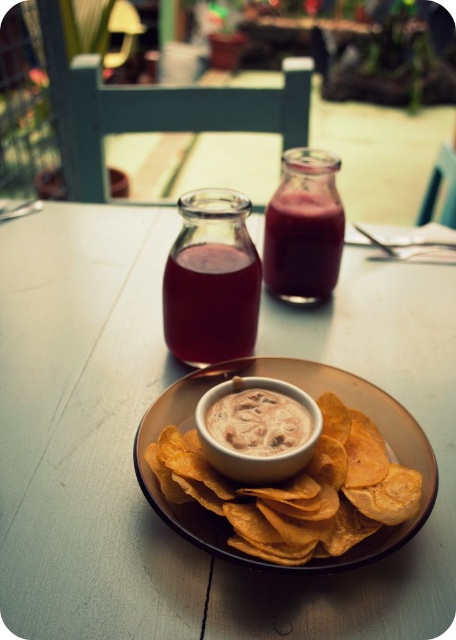
Is golden crispy chips at center wider than translucent glass bottle at center?

Yes, golden crispy chips at center is wider than translucent glass bottle at center.

Looking at this image, is golden crispy chips at center bigger than translucent glass bottle at center?

Indeed, golden crispy chips at center has a larger size compared to translucent glass bottle at center.

Between point (342, 448) and point (206, 312), which one is positioned behind?

The point (206, 312) is more distant.

Locate an element on the screen. This screenshot has width=456, height=640. golden crispy chips at center is located at coordinates (296, 490).

Is translucent glass bottle at center smaller than smooth glass jar at center?

Correct, translucent glass bottle at center occupies less space than smooth glass jar at center.

Is point (245, 326) less distant than point (310, 284)?

Yes, point (245, 326) is closer to viewer.

Locate an element on the screen. The height and width of the screenshot is (640, 456). translucent glass bottle at center is located at coordinates (211, 301).

Is point (228, 445) farther from camera compared to point (327, 241)?

No, (228, 445) is in front of (327, 241).

Does white creamy dip at center come behind smooth glass jar at center?

No, white creamy dip at center is in front of smooth glass jar at center.

Does point (238, 474) come farther from viewer compared to point (330, 230)?

No, (238, 474) is in front of (330, 230).

Where is `white creamy dip at center`? The height and width of the screenshot is (640, 456). white creamy dip at center is located at coordinates (257, 429).